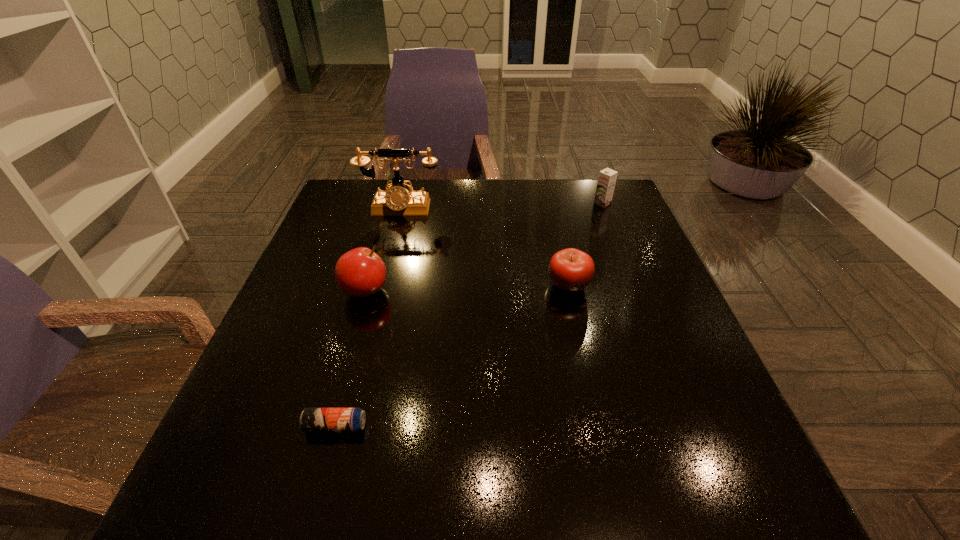
This screenshot has width=960, height=540. In order to click on vacant region between the nearest object and the left apple in this screenshot , I will do `click(350, 359)`.

I want to click on free space between the telephone and the chocolate milk, so click(501, 206).

The width and height of the screenshot is (960, 540). I want to click on empty space that is in between the beer can and the rightmost object, so click(x=468, y=315).

Locate an element on the screen. This screenshot has width=960, height=540. free spot between the fourth object from left to right and the nearest object is located at coordinates (452, 355).

This screenshot has height=540, width=960. Find the location of `free space that is in between the nearest object and the telephone`. free space that is in between the nearest object and the telephone is located at coordinates (368, 318).

In order to click on free space between the second object from right to left and the left apple in this screenshot , I will do `click(467, 287)`.

Identify the location of object that stands as the closest to the beer can. (360, 272).

Where is `object that is the second closest to the fourth object from left to right`? object that is the second closest to the fourth object from left to right is located at coordinates (396, 201).

Where is `free location that satisfies the following two spatial constraints: 1. on the back side of the left apple; 2. on the left side of the right apple`? This screenshot has height=540, width=960. free location that satisfies the following two spatial constraints: 1. on the back side of the left apple; 2. on the left side of the right apple is located at coordinates (367, 284).